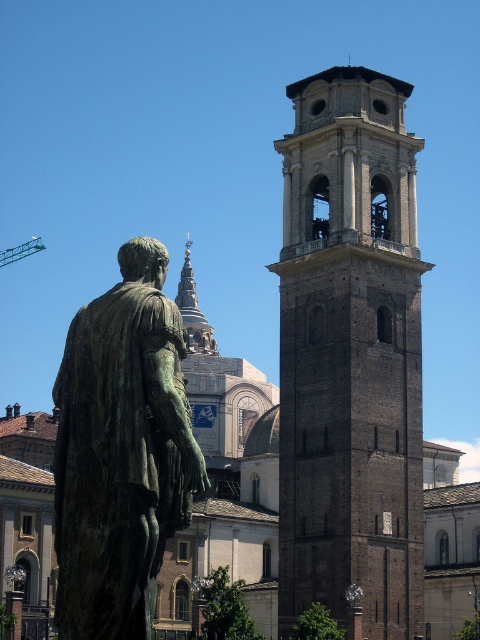
How far apart are brown brick tower at center and green patina statue at center?

brown brick tower at center and green patina statue at center are 127.66 feet apart.

Does point (402, 381) come behind point (70, 515)?

Yes, it is behind point (70, 515).

Where is `brown brick tower at center`? Image resolution: width=480 pixels, height=640 pixels. brown brick tower at center is located at coordinates (350, 355).